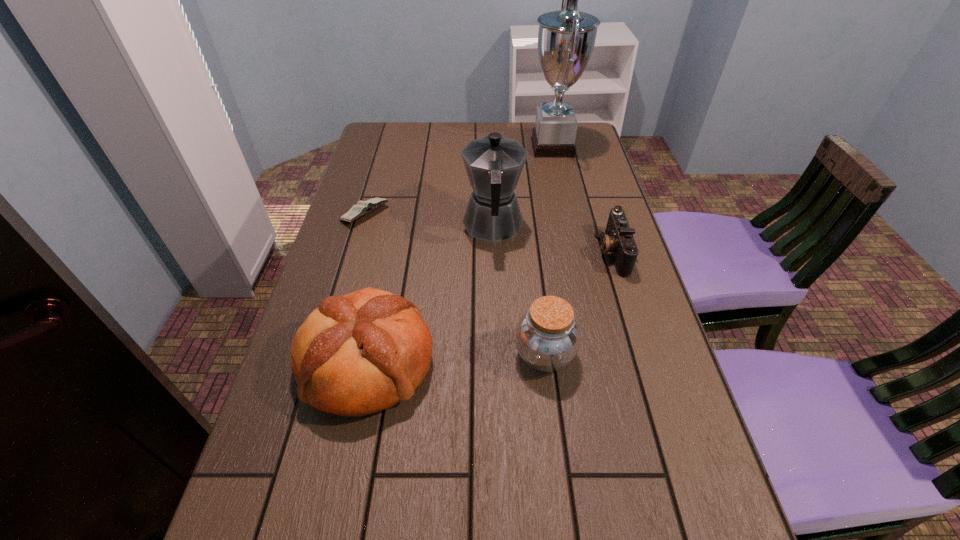
In order to click on the farthest object in this screenshot , I will do `click(566, 38)`.

This screenshot has height=540, width=960. I want to click on the tallest object, so click(566, 38).

Find the location of `coffeepot`. coffeepot is located at coordinates (494, 164).

At what (x,y) coordinates should I click in order to perform the action: click on bread. Please return your answer as a coordinate pair (x, y). The width and height of the screenshot is (960, 540). Looking at the image, I should click on (364, 352).

Locate an element on the screen. Image resolution: width=960 pixels, height=540 pixels. jar is located at coordinates (547, 337).

At what (x,y) coordinates should I click in order to perform the action: click on the fifth tallest object. Please return your answer as a coordinate pair (x, y). This screenshot has height=540, width=960. Looking at the image, I should click on (618, 239).

The image size is (960, 540). In order to click on the shortest object in this screenshot , I will do `click(363, 207)`.

The width and height of the screenshot is (960, 540). I want to click on free point located at the front view of the trophy cup, so click(x=475, y=147).

What are the coordinates of `vacant space located 0.210m at the front view of the trophy cup` in the screenshot? It's located at click(x=467, y=147).

Image resolution: width=960 pixels, height=540 pixels. I want to click on vacant space situated 0.290m at the front view of the trophy cup, so click(x=444, y=147).